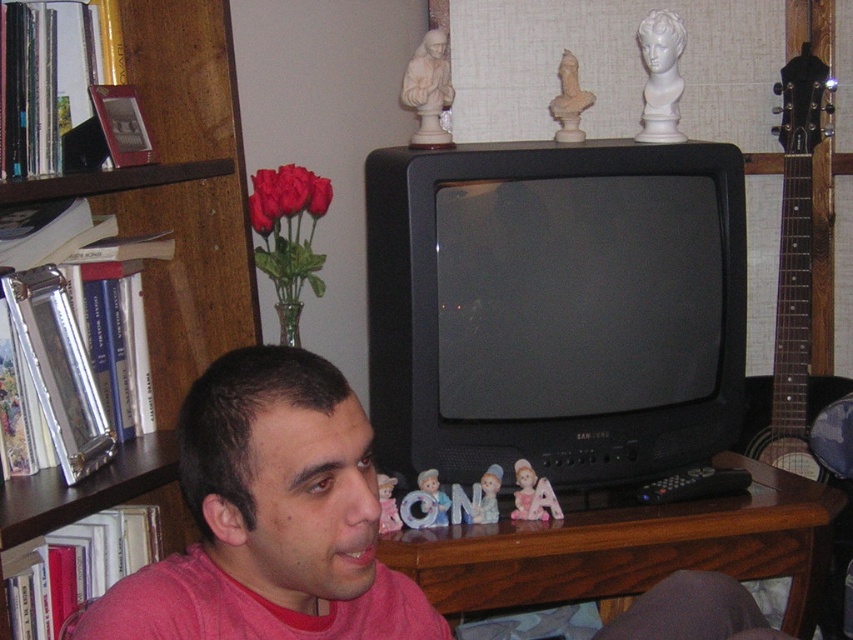
Based on the photo, what is located at the coordinates point (x=387, y=506)?

At point (x=387, y=506) lies a matte plastic doll at center.